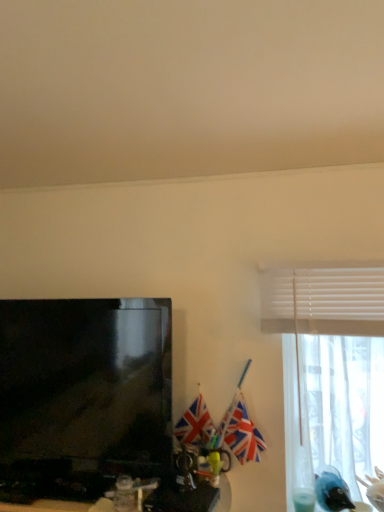
Question: Considering the relative positions of polyester flag at center, the first flag when ordered from left to right, and matte black television at left in the image provided, is polyester flag at center, the first flag when ordered from left to right, to the left of matte black television at left from the viewer's perspective?

Choices:
 (A) yes
 (B) no

Answer: (B)

Question: Does polyester flag at center, the first flag when ordered from left to right, have a lesser height compared to matte black television at left?

Choices:
 (A) no
 (B) yes

Answer: (B)

Question: Can you confirm if polyester flag at center, marked as the second flag in a right-to-left arrangement, is positioned to the right of matte black television at left?

Choices:
 (A) no
 (B) yes

Answer: (B)

Question: From a real-world perspective, does polyester flag at center, marked as the second flag in a right-to-left arrangement, stand above matte black television at left?

Choices:
 (A) no
 (B) yes

Answer: (A)

Question: Is polyester flag at center, marked as the second flag in a right-to-left arrangement, not inside matte black television at left?

Choices:
 (A) no
 (B) yes

Answer: (B)

Question: Considering the positions of matte black television at left and shiny plastic computer desk at lower left in the image, is matte black television at left bigger or smaller than shiny plastic computer desk at lower left?

Choices:
 (A) small
 (B) big

Answer: (A)

Question: Is matte black television at left taller or shorter than shiny plastic computer desk at lower left?

Choices:
 (A) tall
 (B) short

Answer: (A)

Question: Is matte black television at left spatially inside shiny plastic computer desk at lower left, or outside of it?

Choices:
 (A) inside
 (B) outside

Answer: (B)

Question: From a real-world perspective, relative to shiny plastic computer desk at lower left, is matte black television at left vertically above or below?

Choices:
 (A) below
 (B) above

Answer: (B)

Question: Relative to shiny plastic computer desk at lower left, is polyester flag at center, the first flag when ordered from left to right, in front or behind?

Choices:
 (A) behind
 (B) front

Answer: (A)

Question: Does point (178, 433) appear closer or farther from the camera than point (160, 501)?

Choices:
 (A) farther
 (B) closer

Answer: (A)

Question: Based on their positions, is polyester flag at center, the first flag when ordered from left to right, located to the left or right of shiny plastic computer desk at lower left?

Choices:
 (A) right
 (B) left

Answer: (A)

Question: In terms of width, does polyester flag at center, the first flag when ordered from left to right, look wider or thinner when compared to shiny plastic computer desk at lower left?

Choices:
 (A) wide
 (B) thin

Answer: (B)

Question: Is point (77, 510) closer or farther from the camera than point (228, 417)?

Choices:
 (A) closer
 (B) farther

Answer: (A)

Question: In terms of width, does shiny plastic computer desk at lower left look wider or thinner when compared to union jack flag at right, positioned as the 1th flag in right-to-left order?

Choices:
 (A) thin
 (B) wide

Answer: (B)